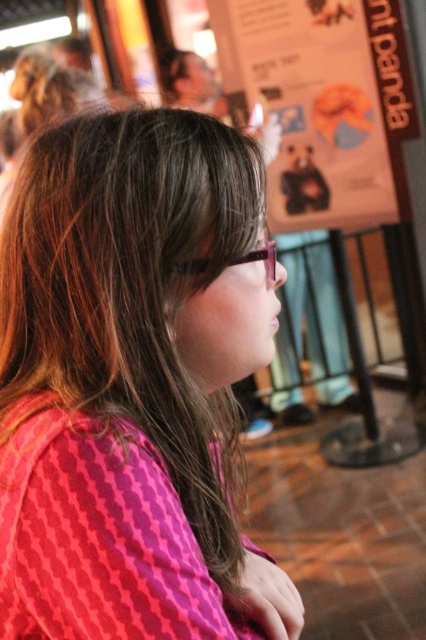
Question: Which of the following is the closest to the observer?

Choices:
 (A) white paper poster at upper center
 (B) pink fabric shirt at center
 (C) matte plastic glasses at center

Answer: (B)

Question: Does pink fabric shirt at center come in front of matte plastic glasses at center?

Choices:
 (A) yes
 (B) no

Answer: (A)

Question: Does white paper poster at upper center lie in front of matte plastic glasses at center?

Choices:
 (A) yes
 (B) no

Answer: (B)

Question: Which point is closer to the camera?

Choices:
 (A) matte plastic glasses at center
 (B) white paper poster at upper center
 (C) pink fabric shirt at center

Answer: (C)

Question: Which of the following is the farthest from the observer?

Choices:
 (A) (207, 273)
 (B) (135, 396)

Answer: (A)

Question: Can you confirm if white paper poster at upper center is positioned to the right of matte plastic glasses at center?

Choices:
 (A) no
 (B) yes

Answer: (B)